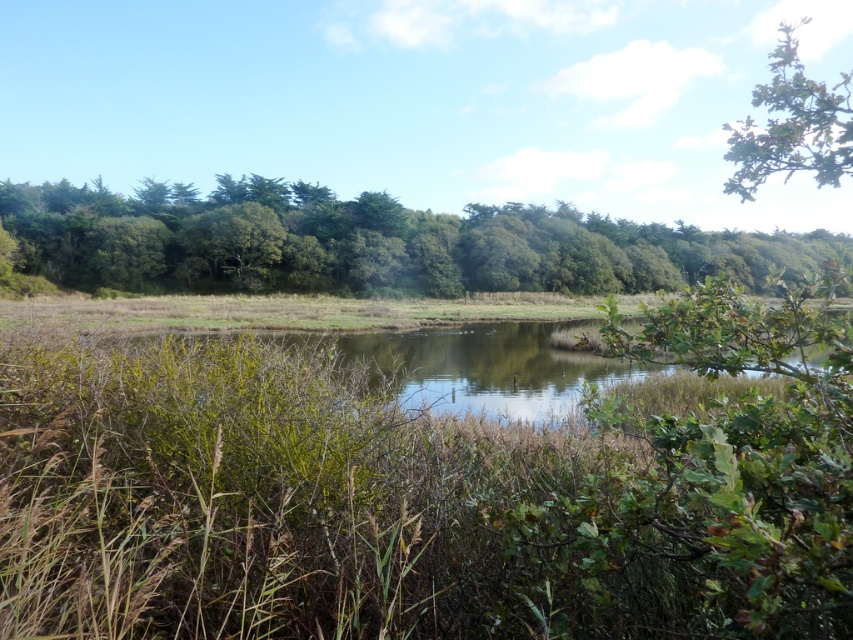
Question: Can you confirm if green leafy trees at center is positioned above green leafy tree at upper right?

Choices:
 (A) no
 (B) yes

Answer: (A)

Question: Is green leafy trees at center to the left of green leafy tree at upper right from the viewer's perspective?

Choices:
 (A) yes
 (B) no

Answer: (A)

Question: Can you confirm if green leafy trees at center is positioned to the left of green leafy tree at upper right?

Choices:
 (A) yes
 (B) no

Answer: (A)

Question: Which point is farther to the camera?

Choices:
 (A) (343, 266)
 (B) (798, 76)

Answer: (A)

Question: Which point appears farthest from the camera in this image?

Choices:
 (A) (786, 38)
 (B) (685, 259)

Answer: (A)

Question: Among these points, which one is nearest to the camera?

Choices:
 (A) (563, 253)
 (B) (833, 129)

Answer: (B)